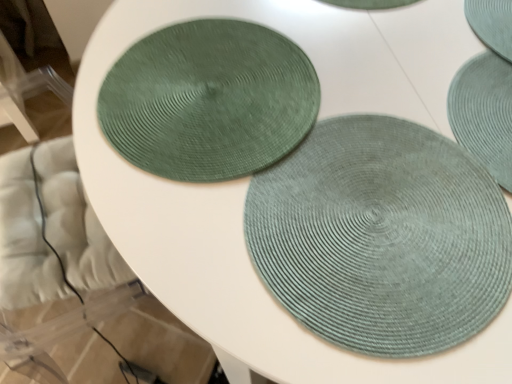
Locate an element on the screen. The height and width of the screenshot is (384, 512). free location to the left of sage green woven mat at center, placed as the second mat when sorted from front to back is located at coordinates (366, 143).